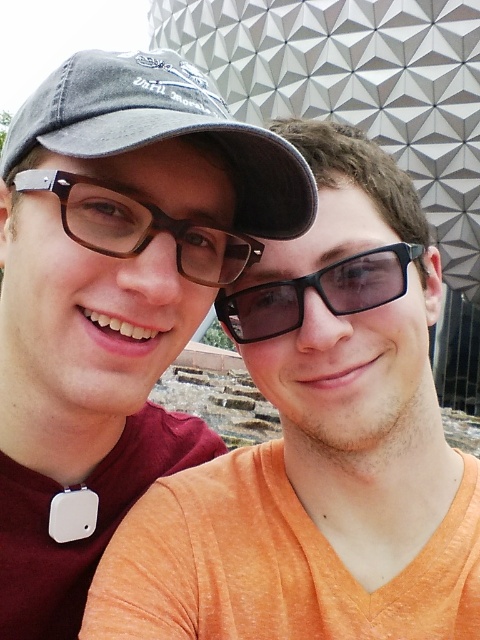
You are a photographer trying to adjust the framing of a photo where two people are wearing glasses. The scene includes a matte black glasses at left and a brown matte glasses at center. Which glasses should you focus on if you want to capture the taller one in the frame?

The matte black glasses at left is taller than the brown matte glasses at center, so you should focus on the matte black glasses at left to capture the taller one in the frame.

You are a photographer trying to capture a clear shot of both the matte black cap at upper left and the denim baseball cap at upper left. Since both are positioned at the upper left corner of the frame, which one would you adjust to ensure both are fully visible?

The matte black cap at upper left is larger in size than the denim baseball cap at upper left, so you should move the larger matte black cap at upper left slightly to the side to make space for the smaller denim baseball cap at upper left.

You are a photographer trying to capture a closeup of the two caps in the scene. Given that the matte black cap at upper left and the denim baseball cap at upper left are both in the frame, which one would you need to adjust your camera focus on first if they are at different distances from the camera?

The matte black cap at upper left has a larger width than the denim baseball cap at upper left, so it might be closer to the camera. Therefore, you should focus on the matte black cap at upper left first to ensure it is in sharp focus before adjusting for the denim baseball cap at upper left.